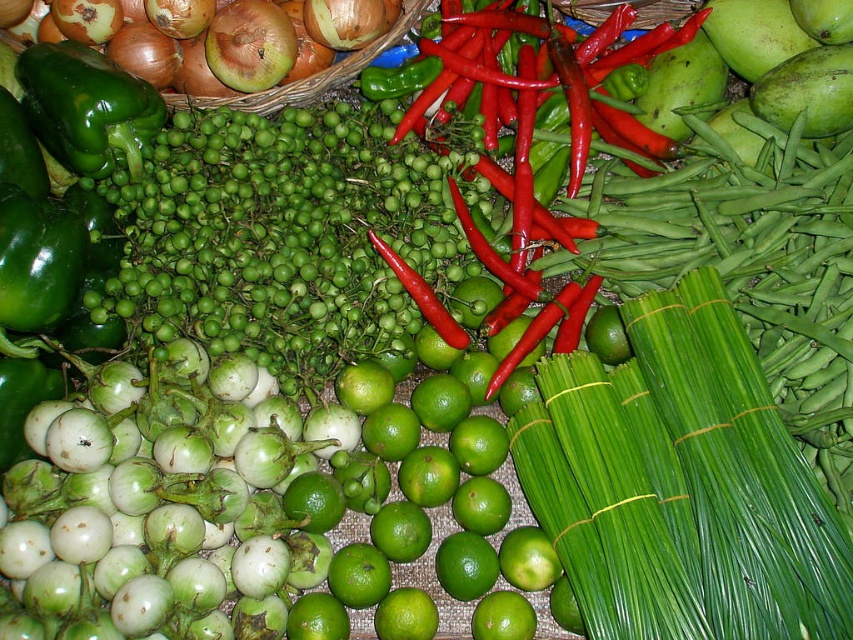
You are a customer at the market and want to pick up the brown textured onion at upper left and the smooth brown onion at upper left. Which one is easier to reach without moving the other?

The brown textured onion at upper left is closer to the viewer than the smooth brown onion at upper left, so it is easier to reach without moving the other.

You are standing in front of a produce display and notice two points marked in the scene. Which point, point (x=259, y=61) or point (x=289, y=67), is closer to you?

Point (x=259, y=61) is closer to the camera than point (x=289, y=67), so it is closer to you.

You are a customer at a market and want to buy the brown textured onion at upper left. The vendor tells you that the onion is located at coordinate point (215, 38). Can you confirm if the onion is in the upper left part of the image?

The brown textured onion at upper left is located at point (215, 38), so yes, it is in the upper left part of the image.